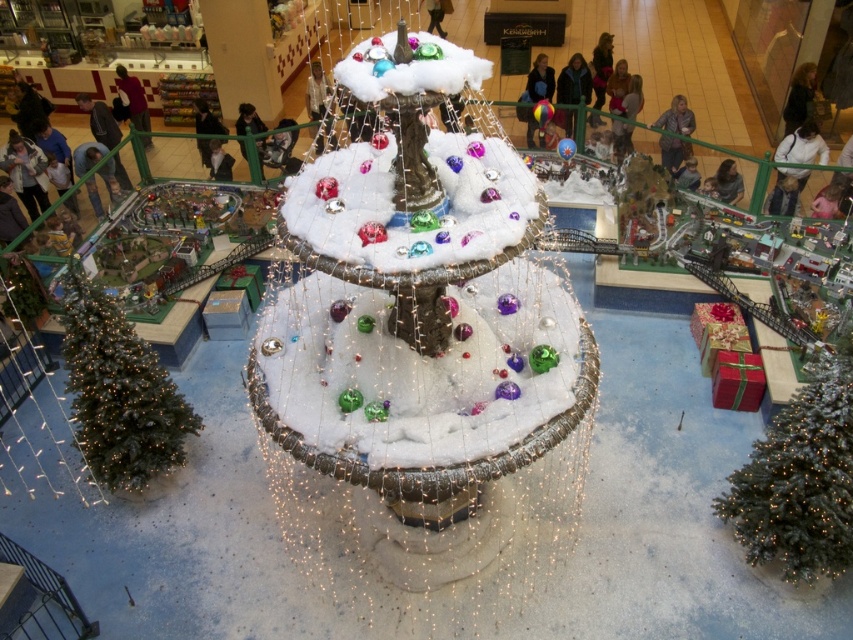
Question: Which point is closer to the camera?

Choices:
 (A) (148, 442)
 (B) (798, 490)

Answer: (B)

Question: Does green matte christmas tree at lower right have a smaller size compared to green matte christmas tree at lower left?

Choices:
 (A) yes
 (B) no

Answer: (A)

Question: Can you confirm if green matte christmas tree at lower right is smaller than green matte christmas tree at lower left?

Choices:
 (A) yes
 (B) no

Answer: (A)

Question: Is green matte christmas tree at lower right smaller than green matte christmas tree at lower left?

Choices:
 (A) yes
 (B) no

Answer: (A)

Question: Which point is farther from the camera taking this photo?

Choices:
 (A) (103, 420)
 (B) (764, 464)

Answer: (A)